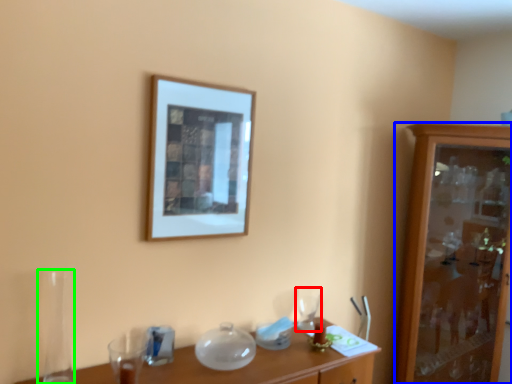
Question: Which object is positioned closest to tableware (highlighted by a red box)? Select from cabinetry (highlighted by a blue box) and glass vase (highlighted by a green box).

Choices:
 (A) cabinetry
 (B) glass vase

Answer: (A)